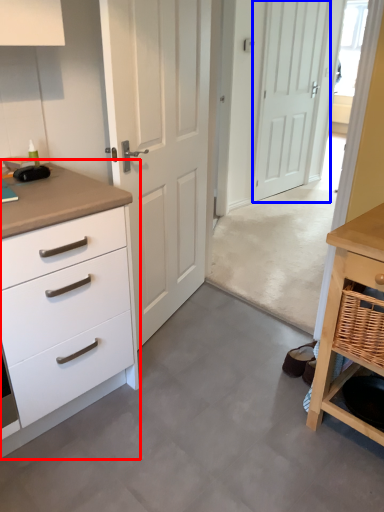
Question: Which object is further to the camera taking this photo, chest of drawers (highlighted by a red box) or door (highlighted by a blue box)?

Choices:
 (A) chest of drawers
 (B) door

Answer: (B)